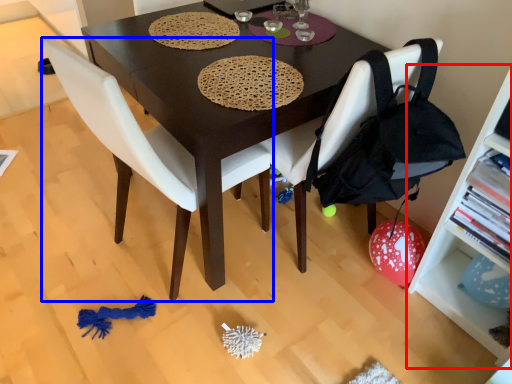
Question: Among these objects, which one is nearest to the camera, shelf (highlighted by a red box) or chair (highlighted by a blue box)?

Choices:
 (A) shelf
 (B) chair

Answer: (A)